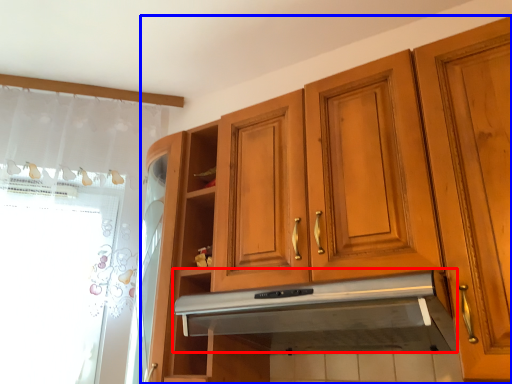
Question: Which object is closer to the camera taking this photo, exhaust hood (highlighted by a red box) or cabinetry (highlighted by a blue box)?

Choices:
 (A) exhaust hood
 (B) cabinetry

Answer: (B)